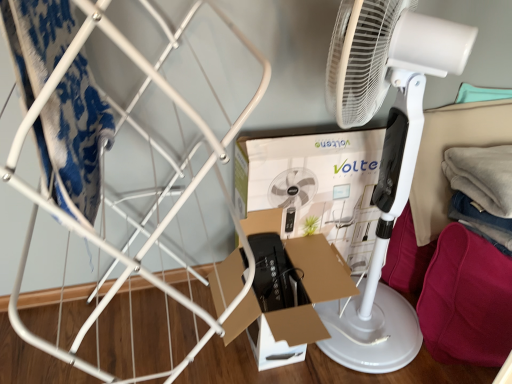
Question: Can you confirm if white plastic mechanical fan at center is smaller than cardboard box at center?

Choices:
 (A) yes
 (B) no

Answer: (B)

Question: From a real-world perspective, is white plastic mechanical fan at center physically above cardboard box at center?

Choices:
 (A) no
 (B) yes

Answer: (B)

Question: From the image's perspective, does white plastic mechanical fan at center appear lower than cardboard box at center?

Choices:
 (A) yes
 (B) no

Answer: (B)

Question: Considering the relative sizes of white plastic mechanical fan at center and cardboard box at center in the image provided, is white plastic mechanical fan at center wider than cardboard box at center?

Choices:
 (A) no
 (B) yes

Answer: (B)

Question: From a real-world perspective, is white plastic mechanical fan at center below cardboard box at center?

Choices:
 (A) no
 (B) yes

Answer: (A)

Question: Are white plastic mechanical fan at center and cardboard box at center beside each other?

Choices:
 (A) yes
 (B) no

Answer: (B)

Question: From a real-world perspective, is white cardboard box at center under burgundy fabric cushion at lower right?

Choices:
 (A) yes
 (B) no

Answer: (B)

Question: Does white cardboard box at center have a larger size compared to burgundy fabric cushion at lower right?

Choices:
 (A) no
 (B) yes

Answer: (B)

Question: Is white cardboard box at center to the left of burgundy fabric cushion at lower right from the viewer's perspective?

Choices:
 (A) yes
 (B) no

Answer: (A)

Question: From a real-world perspective, is white cardboard box at center over burgundy fabric cushion at lower right?

Choices:
 (A) yes
 (B) no

Answer: (A)

Question: Does white cardboard box at center appear on the right side of burgundy fabric cushion at lower right?

Choices:
 (A) yes
 (B) no

Answer: (B)

Question: Is white cardboard box at center turned away from burgundy fabric cushion at lower right?

Choices:
 (A) yes
 (B) no

Answer: (B)

Question: Considering the relative sizes of cardboard box at center and white cardboard box at center in the image provided, is cardboard box at center thinner than white cardboard box at center?

Choices:
 (A) yes
 (B) no

Answer: (B)